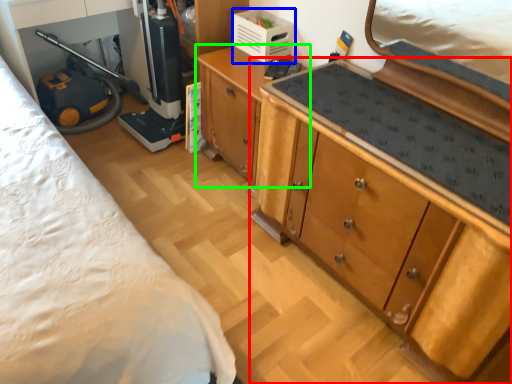
Question: Considering the real-world distances, which object is closest to cabinetry (highlighted by a red box)? appliance (highlighted by a blue box) or cabinetry (highlighted by a green box).

Choices:
 (A) appliance
 (B) cabinetry

Answer: (B)